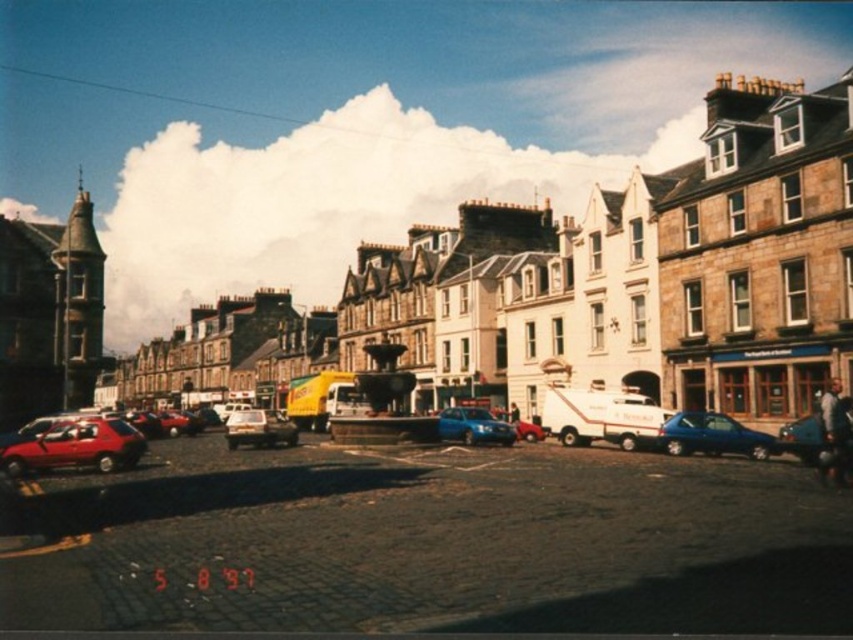
Question: Can you confirm if metallic blue sedan at center is thinner than blue metallic car at center?

Choices:
 (A) no
 (B) yes

Answer: (A)

Question: Is shiny red car at left positioned at the back of blue metallic car at center?

Choices:
 (A) yes
 (B) no

Answer: (B)

Question: Which point is closer to the camera?

Choices:
 (A) (100, 452)
 (B) (265, 422)

Answer: (A)

Question: Which point is closer to the camera?

Choices:
 (A) metallic blue hatchback at center
 (B) metallic blue sedan at center
 (C) shiny red car at left

Answer: (A)

Question: Is metallic blue hatchback at center to the left of shiny silver car at center from the viewer's perspective?

Choices:
 (A) no
 (B) yes

Answer: (A)

Question: Which point appears closest to the camera in this image?

Choices:
 (A) (83, 426)
 (B) (821, 442)

Answer: (B)